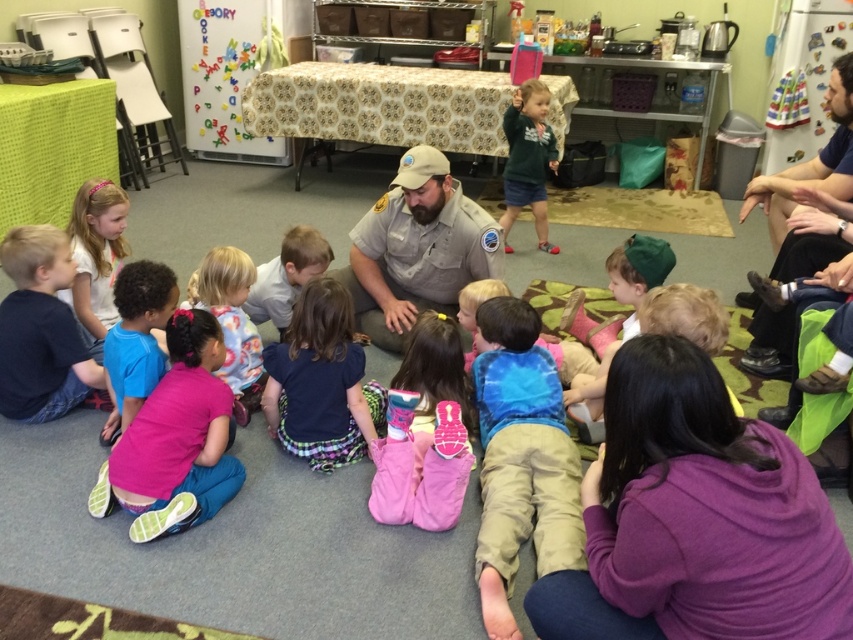
Does brown uniform at center appear on the right side of white matte shirt at center?

Correct, you'll find brown uniform at center to the right of white matte shirt at center.

Is brown uniform at center below white matte shirt at center?

No, brown uniform at center is not below white matte shirt at center.

Is point (389, 323) closer to viewer compared to point (74, 253)?

No, it is not.

Locate an element on the screen. This screenshot has height=640, width=853. brown uniform at center is located at coordinates (416, 248).

Which is behind, point (607, 580) or point (0, 390)?

The point (0, 390) is more distant.

Is point (727, 474) more distant than point (30, 403)?

No, it is in front of (30, 403).

Is point (611, 413) less distant than point (80, 372)?

Yes, point (611, 413) is closer to viewer.

Locate an element on the screen. purple soft sweater at lower right is located at coordinates (695, 518).

Can you confirm if dark blue fabric skirt at center is positioned to the left of green fuzzy sweater at upper right?

Yes, dark blue fabric skirt at center is to the left of green fuzzy sweater at upper right.

Does dark blue fabric skirt at center appear under green fuzzy sweater at upper right?

Yes, dark blue fabric skirt at center is below green fuzzy sweater at upper right.

Is point (357, 429) closer to viewer compared to point (538, 150)?

Yes, it is.

Find the location of a particular element. Image resolution: width=853 pixels, height=640 pixels. dark blue fabric skirt at center is located at coordinates (321, 381).